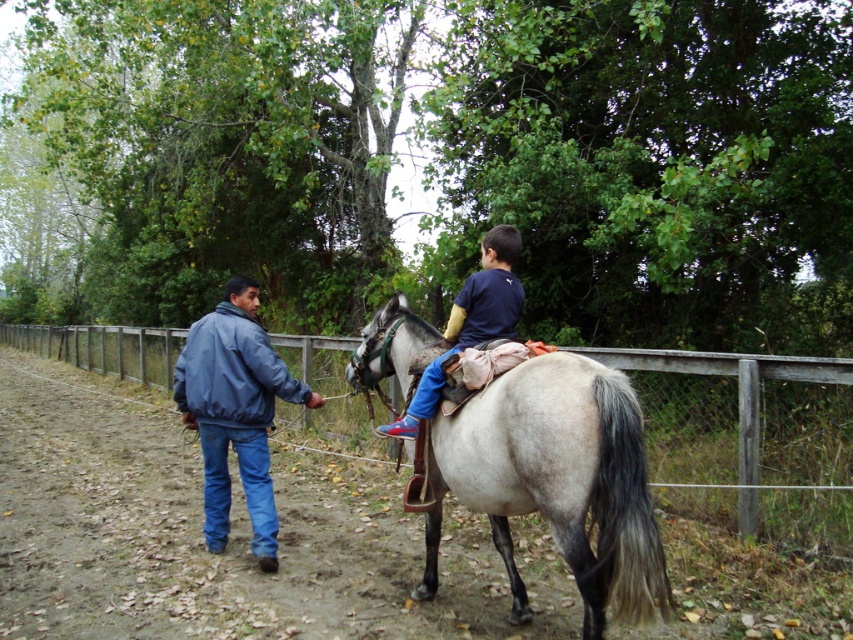
Consider the image. You are a photographer trying to capture a wide shot of the scene. Given that the wooden fence at center and the blue denim jeans at center are both in the frame, which object occupies more horizontal space in the photo?

The wooden fence at center occupies more horizontal space in the photo because its width surpasses that of the blue denim jeans at center.

You are a photographer trying to capture a photo of the wooden fence at center and the blue denim jeans at center. Based on their positions, which object should you focus on first if you want to ensure both are in the same frame?

The wooden fence at center is located below blue denim jeans at center, so you should focus on the blue denim jeans at center first to ensure both are in the frame.